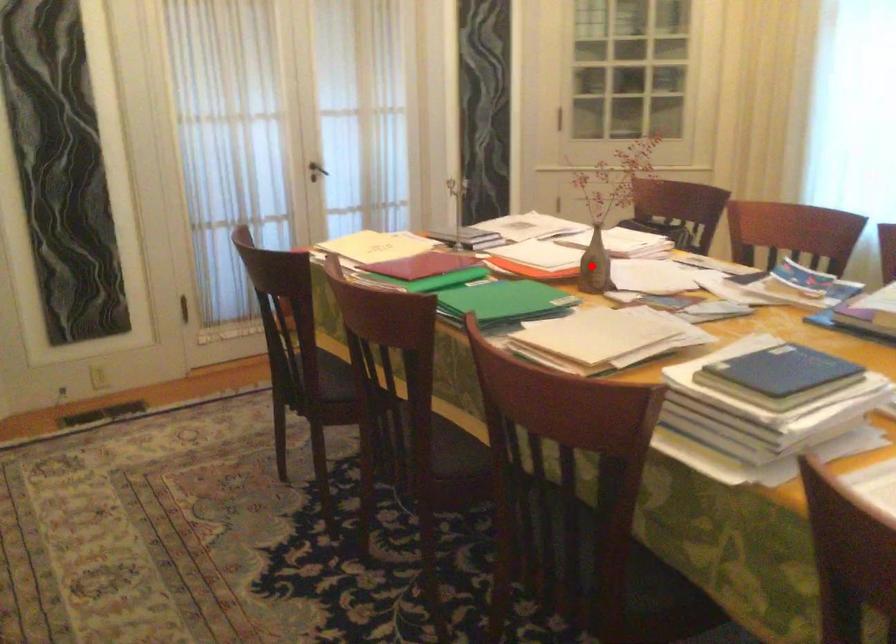
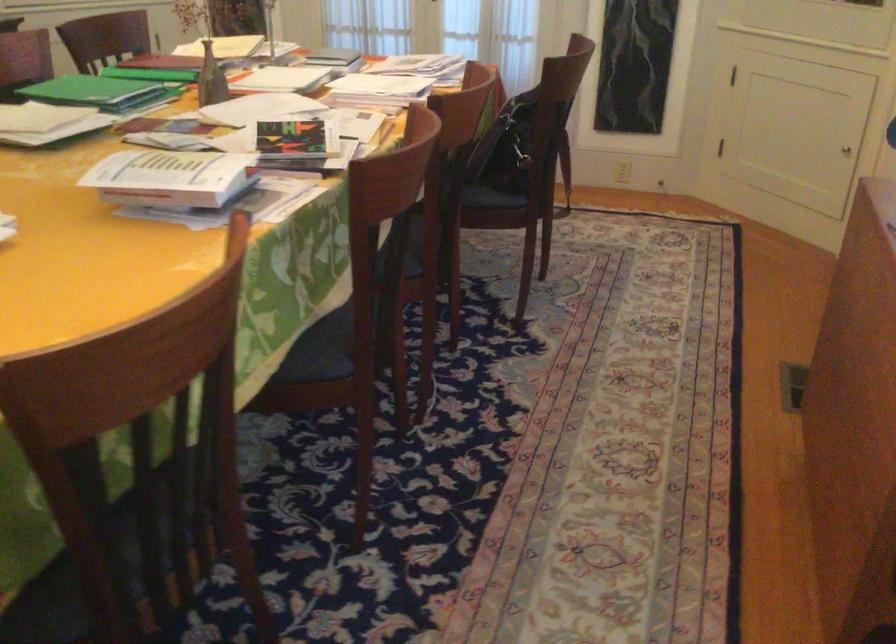
In the second image, find the point that corresponds to the highlighted location in the first image.

(211, 79)